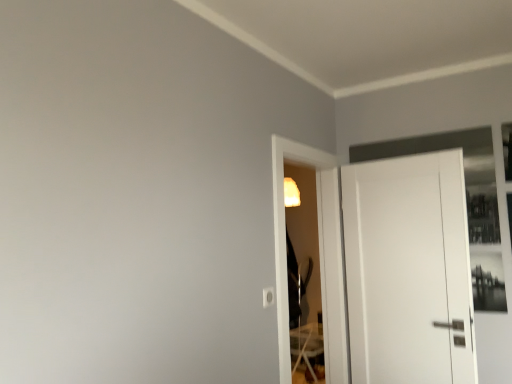
Question: Is point (279, 283) positioned closer to the camera than point (432, 319)?

Choices:
 (A) farther
 (B) closer

Answer: (B)

Question: Looking at their shapes, would you say transparent glass screen door at center is wider or thinner than white matte door at right?

Choices:
 (A) thin
 (B) wide

Answer: (B)

Question: Relative to white matte door at right, is transparent glass screen door at center in front or behind?

Choices:
 (A) behind
 (B) front

Answer: (B)

Question: Looking at the image, does white matte door at right seem bigger or smaller compared to transparent glass screen door at center?

Choices:
 (A) small
 (B) big

Answer: (A)

Question: Is point click(x=357, y=334) closer or farther from the camera than point click(x=273, y=236)?

Choices:
 (A) closer
 (B) farther

Answer: (B)

Question: Is white matte door at right inside or outside of transparent glass screen door at center?

Choices:
 (A) inside
 (B) outside

Answer: (B)

Question: From a real-world perspective, is white matte door at right above or below transparent glass screen door at center?

Choices:
 (A) above
 (B) below

Answer: (B)